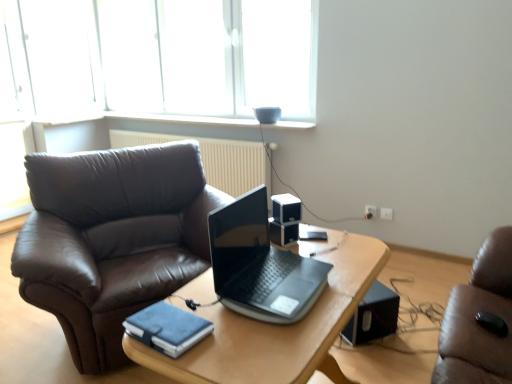
Question: From the image's perspective, is wooden table at center located above or below transparent glass window at upper center?

Choices:
 (A) below
 (B) above

Answer: (A)

Question: Is point 197,367 closer or farther from the camera than point 19,24?

Choices:
 (A) closer
 (B) farther

Answer: (A)

Question: Which object is the farthest from the black plastic speaker at center, the 2th loudspeaker positioned from the back?

Choices:
 (A) blue leather notebook at lower center
 (B) black plastic speaker at lower right, which is the third loudspeaker in front-to-back order
 (C) white plastic speaker at center, acting as the 1th loudspeaker starting from the front
 (D) beige textured radiator at upper center
 (E) wooden table at center

Answer: (D)

Question: Which object is the closest to the beige textured radiator at upper center?

Choices:
 (A) glossy plastic laptop at center
 (B) wooden table at center
 (C) blue leather notebook at lower center
 (D) transparent glass window at upper center
 (E) black plastic speaker at lower right, the 1th loudspeaker from the bottom

Answer: (D)